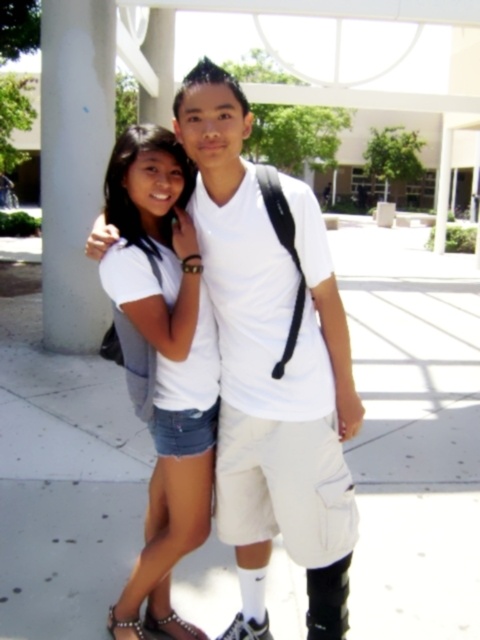
Question: Among these points, which one is nearest to the camera?

Choices:
 (A) (283, 259)
 (B) (136, 620)
 (C) (188, 323)
 (D) (146, 611)

Answer: (A)

Question: Is denim shorts at center further to camera compared to black studded sandal at lower left?

Choices:
 (A) yes
 (B) no

Answer: (B)

Question: Estimate the real-world distances between objects in this image. Which object is closer to the white cotton t-shirt at center?

Choices:
 (A) pearl-embellished sandal at lower left
 (B) black studded sandal at lower left

Answer: (B)

Question: Which of the following is the closest to the observer?

Choices:
 (A) (342, 346)
 (B) (137, 636)

Answer: (A)

Question: Is white cotton t-shirt at center smaller than black studded sandal at lower left?

Choices:
 (A) no
 (B) yes

Answer: (A)

Question: Does white cotton t-shirt at center appear on the right side of denim shorts at center?

Choices:
 (A) yes
 (B) no

Answer: (A)